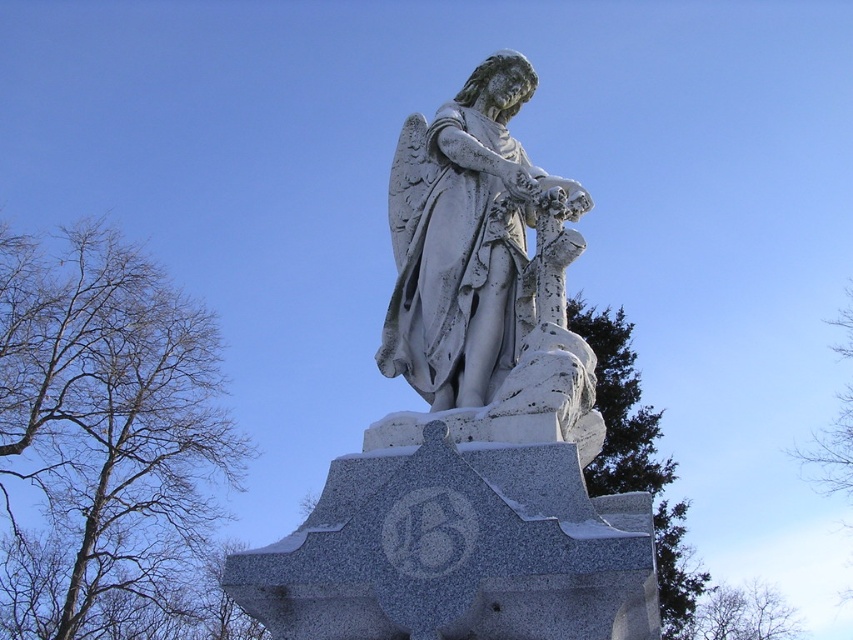
Question: Which point appears farthest from the camera in this image?

Choices:
 (A) (851, 435)
 (B) (466, 259)

Answer: (A)

Question: Which of the following is the closest to the observer?

Choices:
 (A) green textured stone at right
 (B) green leafy tree at upper center
 (C) green leafless branches at upper right
 (D) white stone statue at center

Answer: (A)

Question: Does bare branches at left have a lesser width compared to green leafless branches at upper right?

Choices:
 (A) no
 (B) yes

Answer: (A)

Question: Is white stone statue at center smaller than green leafless branches at upper right?

Choices:
 (A) yes
 (B) no

Answer: (A)

Question: Considering the real-world distances, which object is farthest from the white marble statue at center?

Choices:
 (A) green textured stone at right
 (B) green leafless branches at upper right
 (C) green leafy tree at upper center
 (D) white stone statue at center

Answer: (B)

Question: Observing the image, what is the correct spatial positioning of white marble statue at center in reference to green leafy tree at upper center?

Choices:
 (A) above
 (B) below

Answer: (A)